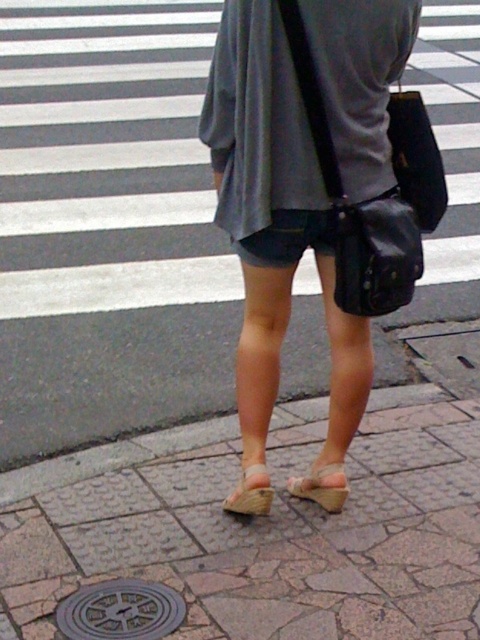
You are a photographer capturing the scene from above. You notice the brown stone pavement at lower center and the beige fabric sandal at lower center. Which object is positioned closer to your camera lens?

The brown stone pavement at lower center is closer to the viewer than the beige fabric sandal at lower center, so the brown stone pavement at lower center would be closer to the camera lens.

What is the 2D coordinate of the brick pavement at center?

The brick pavement at center is located at the 2D coordinate point of (108, 227).